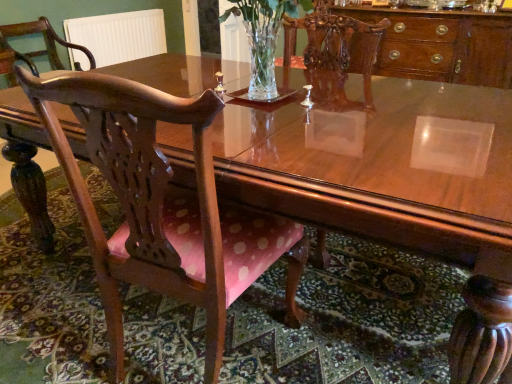
Question: Is polished wood chair at left, the second chair in the bottom-to-top sequence, wider than wooden chair with pink cushion at center, which is the first chair from bottom to top?

Choices:
 (A) yes
 (B) no

Answer: (B)

Question: From the image's perspective, is polished wood chair at left, the second chair in the bottom-to-top sequence, located above wooden chair with pink cushion at center, which ranks as the first chair in right-to-left order?

Choices:
 (A) no
 (B) yes

Answer: (B)

Question: Can you confirm if polished wood chair at left, arranged as the 2th chair when viewed from the front, is smaller than wooden chair with pink cushion at center, which ranks as the first chair in right-to-left order?

Choices:
 (A) yes
 (B) no

Answer: (A)

Question: Considering the relative sizes of polished wood chair at left, arranged as the 2th chair when viewed from the front, and wooden chair with pink cushion at center, acting as the 2th chair starting from the top, in the image provided, is polished wood chair at left, arranged as the 2th chair when viewed from the front, shorter than wooden chair with pink cushion at center, acting as the 2th chair starting from the top,?

Choices:
 (A) no
 (B) yes

Answer: (B)

Question: Is polished wood chair at left, which ranks as the 2th chair in right-to-left order, positioned with its back to wooden chair with pink cushion at center, acting as the first chair starting from the front?

Choices:
 (A) no
 (B) yes

Answer: (A)

Question: Is polished wood chair at left, positioned as the first chair in top-to-bottom order, aimed at wooden chair with pink cushion at center, acting as the first chair starting from the front?

Choices:
 (A) no
 (B) yes

Answer: (A)

Question: Is white ribbed radiator at upper left far away from wooden chair with pink cushion at center, which is counted as the second chair, starting from the back?

Choices:
 (A) no
 (B) yes

Answer: (B)

Question: Is white ribbed radiator at upper left closer to camera compared to wooden chair with pink cushion at center, which is counted as the second chair, starting from the back?

Choices:
 (A) yes
 (B) no

Answer: (B)

Question: From a real-world perspective, does white ribbed radiator at upper left sit lower than wooden chair with pink cushion at center, which ranks as the first chair in right-to-left order?

Choices:
 (A) yes
 (B) no

Answer: (B)

Question: From a real-world perspective, is white ribbed radiator at upper left located higher than wooden chair with pink cushion at center, which is the first chair from bottom to top?

Choices:
 (A) no
 (B) yes

Answer: (B)

Question: Does white ribbed radiator at upper left have a lesser width compared to wooden chair with pink cushion at center, acting as the first chair starting from the front?

Choices:
 (A) no
 (B) yes

Answer: (B)

Question: From the image's perspective, does white ribbed radiator at upper left appear higher than wooden chair with pink cushion at center, acting as the 2th chair starting from the top?

Choices:
 (A) no
 (B) yes

Answer: (B)

Question: Is clear glass vase at center at the back of polished wood cabinet at upper right?

Choices:
 (A) yes
 (B) no

Answer: (B)